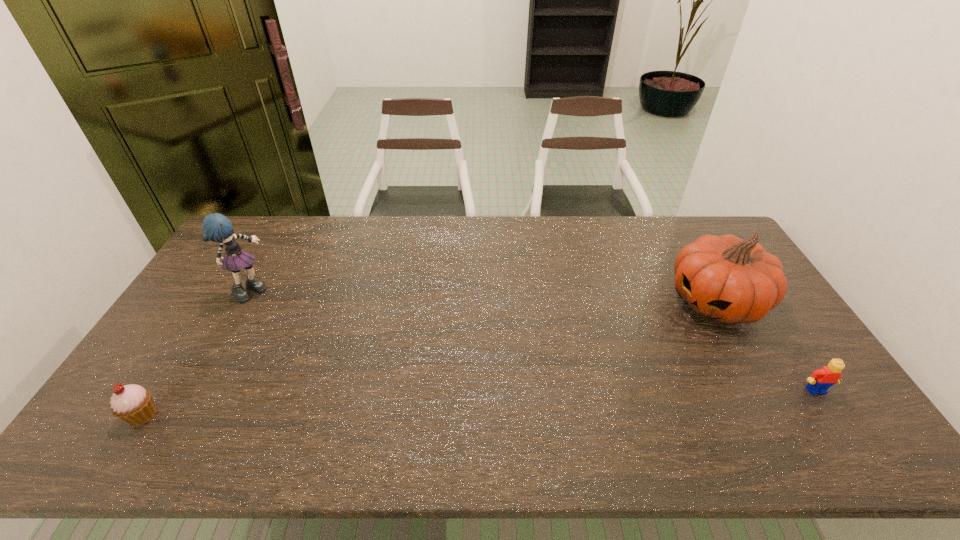
Identify the location of object that is at the near right corner. The width and height of the screenshot is (960, 540). (819, 382).

This screenshot has height=540, width=960. In the image, there is a desktop. In order to click on free space at the far edge in this screenshot , I will do `click(536, 226)`.

The height and width of the screenshot is (540, 960). Find the location of `blank space at the near edge of the desktop`. blank space at the near edge of the desktop is located at coordinates (714, 401).

You are a GUI agent. You are given a task and a screenshot of the screen. Output one action in this format:
    pyautogui.click(x=<x>, y=<y>)
    Task: Click on the vacant space at the left edge of the desktop
    The width and height of the screenshot is (960, 540).
    Given the screenshot: What is the action you would take?
    pyautogui.click(x=210, y=284)

In order to click on vacant point at the far left corner in this screenshot , I will do `click(254, 248)`.

Identify the location of blank region between the nearest object and the third object from right to left. (198, 353).

Where is `blank region between the second nearest object and the tallest object`? blank region between the second nearest object and the tallest object is located at coordinates (534, 340).

This screenshot has height=540, width=960. What are the coordinates of `vacant area between the second nearest object and the leftmost object` in the screenshot? It's located at (479, 402).

This screenshot has width=960, height=540. I want to click on unoccupied area between the second tallest object and the rag doll, so click(x=484, y=295).

I want to click on free space between the pumpkin and the third object from right to left, so click(x=484, y=295).